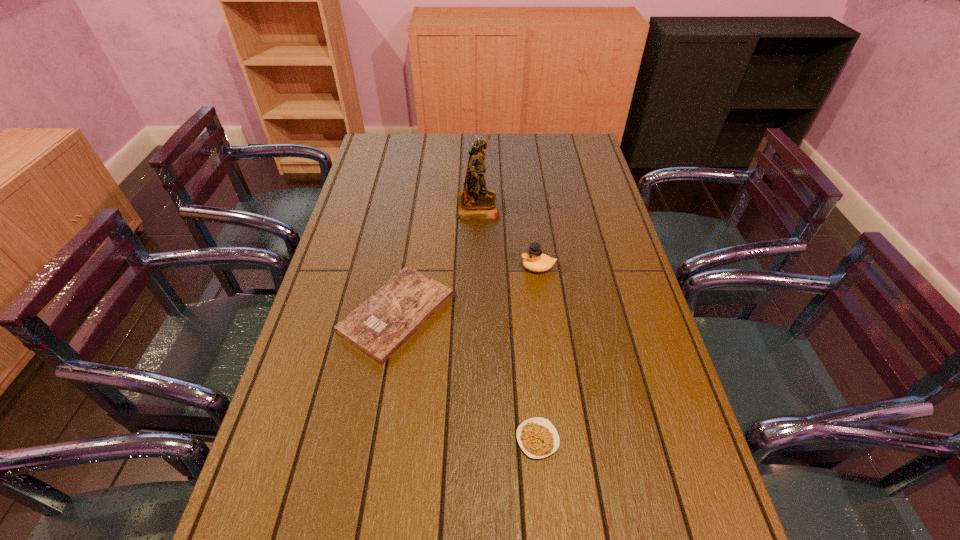
Where is `free space between the shortest object and the figurine`? The height and width of the screenshot is (540, 960). free space between the shortest object and the figurine is located at coordinates (508, 322).

At what (x,y) coordinates should I click in order to perform the action: click on empty space that is in between the shortest object and the second tallest object. Please return your answer as a coordinate pair (x, y). This screenshot has height=540, width=960. Looking at the image, I should click on (538, 353).

At what (x,y) coordinates should I click in order to perform the action: click on vacant area that lies between the third shortest object and the Bible. Please return your answer as a coordinate pair (x, y). Looking at the image, I should click on point(468,290).

You are a GUI agent. You are given a task and a screenshot of the screen. Output one action in this format:
    pyautogui.click(x=<x>, y=<y>)
    Task: Click on the free point between the Bible and the legume
    The height and width of the screenshot is (540, 960).
    Given the screenshot: What is the action you would take?
    pyautogui.click(x=468, y=376)

Locate an element on the screen. vacant space in between the nearest object and the duck is located at coordinates coord(538,353).

At what (x,y) coordinates should I click in order to perform the action: click on vacant space that's between the nearest object and the Bible. Please return your answer as a coordinate pair (x, y). Looking at the image, I should click on (468, 376).

Locate an element on the screen. free space between the third shortest object and the Bible is located at coordinates (468, 290).

This screenshot has width=960, height=540. Identify the location of object that can be found as the closest to the nearest object. (379, 326).

Choose which object is the third nearest neighbor to the second tallest object. Please provide its 2D coordinates. Your answer should be formatted as a tuple, i.e. [(x, y)], where the tuple contains the x and y coordinates of a point satisfying the conditions above.

[(538, 438)]

The image size is (960, 540). What are the coordinates of `free location that satisfies the following two spatial constraints: 1. on the front side of the Bible; 2. on the right side of the legume` in the screenshot? It's located at (375, 439).